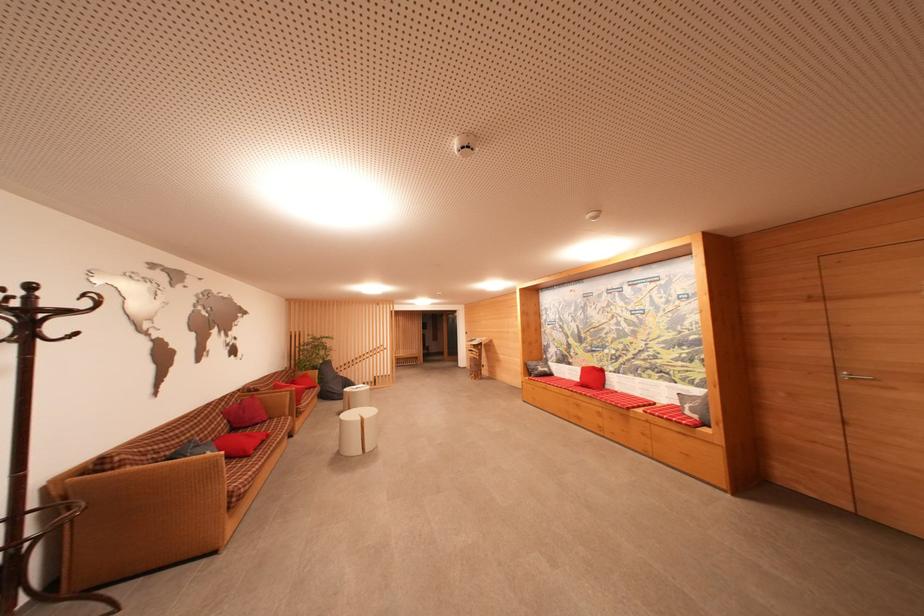
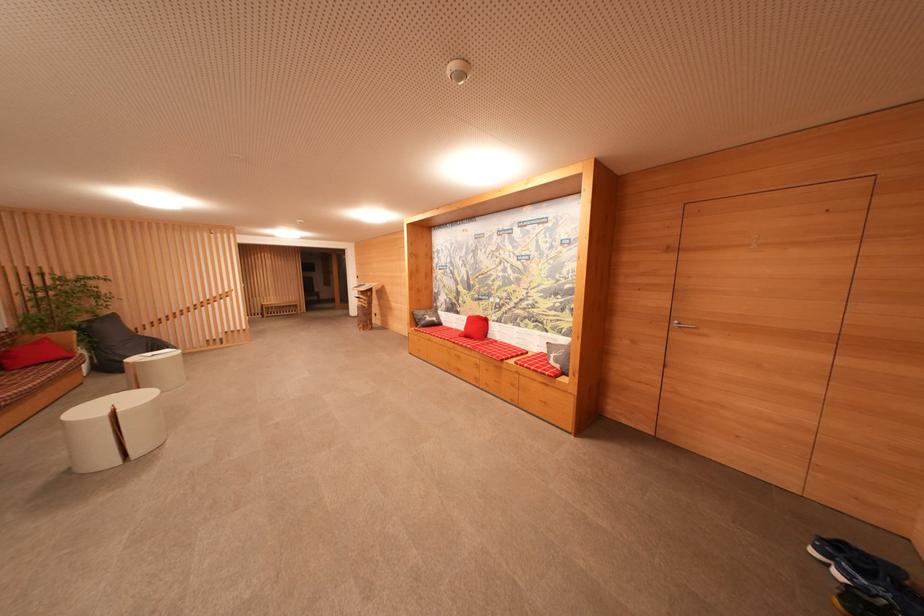
In the second image, find the point that corresponds to (x=598, y=371) in the first image.

(482, 321)